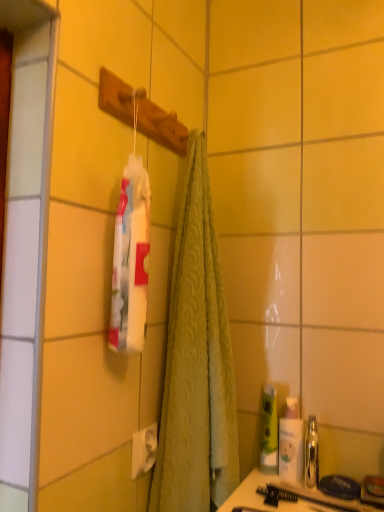
How much space does green matte bottle at lower right, arranged as the second mouthwash when viewed from the right, occupy vertically?

The height of green matte bottle at lower right, arranged as the second mouthwash when viewed from the right, is 7.90 inches.

Image resolution: width=384 pixels, height=512 pixels. What do you see at coordinates (311, 454) in the screenshot?
I see `shiny metallic mouthwash at right, the 2th mouthwash in the left-to-right sequence` at bounding box center [311, 454].

This screenshot has height=512, width=384. What do you see at coordinates (291, 442) in the screenshot?
I see `translucent plastic bottle at right` at bounding box center [291, 442].

Locate an element on the screen. The image size is (384, 512). green matte bottle at lower right, arranged as the second mouthwash when viewed from the right is located at coordinates (269, 426).

Is the depth of shiny metallic mouthwash at right, the 2th mouthwash in the left-to-right sequence, greater than that of translucent plastic bottle at right?

That is False.

Considering the relative positions of shiny metallic mouthwash at right, the 2th mouthwash in the left-to-right sequence, and translucent plastic bottle at right in the image provided, is shiny metallic mouthwash at right, the 2th mouthwash in the left-to-right sequence, to the right of translucent plastic bottle at right from the viewer's perspective?

Yes.

Can you confirm if shiny metallic mouthwash at right, the 2th mouthwash in the left-to-right sequence, is bigger than translucent plastic bottle at right?

Incorrect, shiny metallic mouthwash at right, the 2th mouthwash in the left-to-right sequence, is not larger than translucent plastic bottle at right.

Can you confirm if shiny metallic mouthwash at right, acting as the first mouthwash starting from the right, is wider than translucent plastic bottle at right?

Yes, shiny metallic mouthwash at right, acting as the first mouthwash starting from the right, is wider than translucent plastic bottle at right.

From the picture: Does matte black comb at lower center have a greater width compared to shiny metallic mouthwash at right, acting as the first mouthwash starting from the right?

Incorrect, the width of matte black comb at lower center does not surpass that of shiny metallic mouthwash at right, acting as the first mouthwash starting from the right.

Considering the sizes of objects matte black comb at lower center and shiny metallic mouthwash at right, acting as the first mouthwash starting from the right, in the image provided, who is smaller, matte black comb at lower center or shiny metallic mouthwash at right, acting as the first mouthwash starting from the right,?

Smaller between the two is matte black comb at lower center.

Which is more to the left, matte black comb at lower center or shiny metallic mouthwash at right, the 2th mouthwash in the left-to-right sequence?

matte black comb at lower center.

Is matte black comb at lower center in contact with shiny metallic mouthwash at right, acting as the first mouthwash starting from the right?

Yes.

Is shiny metallic mouthwash at right, acting as the first mouthwash starting from the right, thinner than green matte bottle at lower right, arranged as the second mouthwash when viewed from the right?

No.

Could you tell me if shiny metallic mouthwash at right, acting as the first mouthwash starting from the right, is turned towards green matte bottle at lower right, arranged as the second mouthwash when viewed from the right?

No, shiny metallic mouthwash at right, acting as the first mouthwash starting from the right, is not aimed at green matte bottle at lower right, arranged as the second mouthwash when viewed from the right.

Can you tell me how much shiny metallic mouthwash at right, acting as the first mouthwash starting from the right, and green matte bottle at lower right, arranged as the second mouthwash when viewed from the right, differ in facing direction?

shiny metallic mouthwash at right, acting as the first mouthwash starting from the right, and green matte bottle at lower right, arranged as the second mouthwash when viewed from the right, are facing 0.000144 degrees away from each other.

Is shiny metallic mouthwash at right, the 2th mouthwash in the left-to-right sequence, taller or shorter than green matte bottle at lower right, arranged as the second mouthwash when viewed from the right?

In the image, shiny metallic mouthwash at right, the 2th mouthwash in the left-to-right sequence, appears to be shorter than green matte bottle at lower right, arranged as the second mouthwash when viewed from the right.

From the image's perspective, is shiny metallic mouthwash at right, the 2th mouthwash in the left-to-right sequence, located above or below matte black comb at lower center?

From the image's perspective, shiny metallic mouthwash at right, the 2th mouthwash in the left-to-right sequence, appears above matte black comb at lower center.

Which object is positioned more to the right, shiny metallic mouthwash at right, the 2th mouthwash in the left-to-right sequence, or matte black comb at lower center?

From the viewer's perspective, shiny metallic mouthwash at right, the 2th mouthwash in the left-to-right sequence, appears more on the right side.

Who is shorter, shiny metallic mouthwash at right, the 2th mouthwash in the left-to-right sequence, or matte black comb at lower center?

Standing shorter between the two is matte black comb at lower center.

Considering the positions of points (311, 460) and (316, 501), is point (311, 460) closer to camera compared to point (316, 501)?

No.

From a real-world perspective, is matte black comb at lower center over translucent plastic bottle at right?

No, from a real-world perspective, matte black comb at lower center is not over translucent plastic bottle at right

Looking at this image, how different are the orientations of matte black comb at lower center and translucent plastic bottle at right in degrees?

0.000105 degrees separate the facing orientations of matte black comb at lower center and translucent plastic bottle at right.

Is matte black comb at lower center inside or outside of translucent plastic bottle at right?

matte black comb at lower center lies outside translucent plastic bottle at right.

From the image's perspective, is matte black comb at lower center positioned above or below translucent plastic bottle at right?

From the image's perspective, matte black comb at lower center appears below translucent plastic bottle at right.

Where is `toiletry above the matte black comb at lower center (from the image's perspective)`? toiletry above the matte black comb at lower center (from the image's perspective) is located at coordinates (291, 442).

In the scene shown: Which of these two, translucent plastic bottle at right or matte black comb at lower center, is smaller?

Smaller between the two is matte black comb at lower center.

Which of these two, translucent plastic bottle at right or matte black comb at lower center, is thinner?

translucent plastic bottle at right is thinner.

From a real-world perspective, which object stands above the other?

translucent plastic bottle at right is physically above.

Considering the sizes of objects green matte bottle at lower right, arranged as the second mouthwash when viewed from the right, and matte black comb at lower center in the image provided, who is wider, green matte bottle at lower right, arranged as the second mouthwash when viewed from the right, or matte black comb at lower center?

Wider between the two is matte black comb at lower center.

Does green matte bottle at lower right, arranged as the second mouthwash when viewed from the right, turn towards matte black comb at lower center?

No, green matte bottle at lower right, arranged as the second mouthwash when viewed from the right, is not aimed at matte black comb at lower center.

Can you see green matte bottle at lower right, the 1th mouthwash viewed from the left, touching matte black comb at lower center?

Yes, the surface of green matte bottle at lower right, the 1th mouthwash viewed from the left, is in contact with matte black comb at lower center.

In order to click on toiletry above the shiny metallic mouthwash at right, acting as the first mouthwash starting from the right (from a real-world perspective) in this screenshot , I will do `click(291, 442)`.

This screenshot has width=384, height=512. Identify the location of the 1st mouthwash positioned above the matte black comb at lower center (from the image's perspective). (311, 454).

From the image, which object appears to be farther from green matte bottle at lower right, the 1th mouthwash viewed from the left, shiny metallic mouthwash at right, the 2th mouthwash in the left-to-right sequence, or translucent plastic bottle at right?

Based on the image, shiny metallic mouthwash at right, the 2th mouthwash in the left-to-right sequence, appears to be further to green matte bottle at lower right, the 1th mouthwash viewed from the left.

From the image, which object appears to be farther from matte black comb at lower center, shiny metallic mouthwash at right, acting as the first mouthwash starting from the right, or green matte bottle at lower right, the 1th mouthwash viewed from the left?

Based on the image, green matte bottle at lower right, the 1th mouthwash viewed from the left, appears to be further to matte black comb at lower center.

Which object lies nearer to the anchor point translucent plastic bottle at right, shiny metallic mouthwash at right, acting as the first mouthwash starting from the right, or green matte bottle at lower right, the 1th mouthwash viewed from the left?

shiny metallic mouthwash at right, acting as the first mouthwash starting from the right.

Which object lies further to the anchor point green matte bottle at lower right, arranged as the second mouthwash when viewed from the right, shiny metallic mouthwash at right, acting as the first mouthwash starting from the right, or matte black comb at lower center?

matte black comb at lower center.

Looking at the image, which one is located closer to shiny metallic mouthwash at right, the 2th mouthwash in the left-to-right sequence, matte black comb at lower center or translucent plastic bottle at right?

translucent plastic bottle at right is positioned closer to the anchor shiny metallic mouthwash at right, the 2th mouthwash in the left-to-right sequence.

Looking at the image, which one is located closer to translucent plastic bottle at right, green matte bottle at lower right, arranged as the second mouthwash when viewed from the right, or shiny metallic mouthwash at right, acting as the first mouthwash starting from the right?

shiny metallic mouthwash at right, acting as the first mouthwash starting from the right, lies closer to translucent plastic bottle at right than the other object.

Estimate the real-world distances between objects in this image. Which object is closer to green matte bottle at lower right, the 1th mouthwash viewed from the left, translucent plastic bottle at right or shiny metallic mouthwash at right, the 2th mouthwash in the left-to-right sequence?

The object closer to green matte bottle at lower right, the 1th mouthwash viewed from the left, is translucent plastic bottle at right.

When comparing their distances from shiny metallic mouthwash at right, the 2th mouthwash in the left-to-right sequence, does translucent plastic bottle at right or green matte bottle at lower right, the 1th mouthwash viewed from the left, seem further?

green matte bottle at lower right, the 1th mouthwash viewed from the left, is positioned further to the anchor shiny metallic mouthwash at right, the 2th mouthwash in the left-to-right sequence.

This screenshot has width=384, height=512. Find the location of `toiletry between green matte bottle at lower right, the 1th mouthwash viewed from the left, and shiny metallic mouthwash at right, acting as the first mouthwash starting from the right, from left to right`. toiletry between green matte bottle at lower right, the 1th mouthwash viewed from the left, and shiny metallic mouthwash at right, acting as the first mouthwash starting from the right, from left to right is located at coordinates (291, 442).

Where is `mouthwash located between matte black comb at lower center and translucent plastic bottle at right in the depth direction`? mouthwash located between matte black comb at lower center and translucent plastic bottle at right in the depth direction is located at coordinates (311, 454).

The image size is (384, 512). I want to click on mouthwash located between matte black comb at lower center and green matte bottle at lower right, arranged as the second mouthwash when viewed from the right, in the depth direction, so click(311, 454).

Locate an element on the screen. The width and height of the screenshot is (384, 512). toiletry between matte black comb at lower center and green matte bottle at lower right, the 1th mouthwash viewed from the left, from front to back is located at coordinates (291, 442).